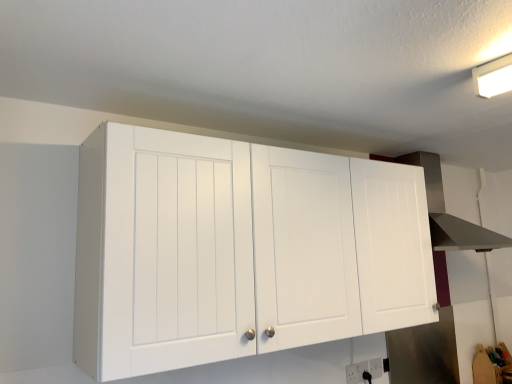
Question: In terms of width, does white plastic electric outlet at lower center, which appears as the 2th electric outlet when viewed from the front, look wider or thinner when compared to stainless steel vent at upper right?

Choices:
 (A) wide
 (B) thin

Answer: (B)

Question: Is white plastic electric outlet at lower center, placed as the first electric outlet when sorted from back to front, bigger or smaller than stainless steel vent at upper right?

Choices:
 (A) small
 (B) big

Answer: (A)

Question: Which is nearer to the white plastic electric outlet at lower center, the first electric outlet viewed from the front?

Choices:
 (A) stainless steel vent at upper right
 (B) white plastic electric outlet at lower center, placed as the first electric outlet when sorted from back to front
 (C) white matte cabinet at upper center

Answer: (B)

Question: Estimate the real-world distances between objects in this image. Which object is farther from the white matte cabinet at upper center?

Choices:
 (A) stainless steel vent at upper right
 (B) white plastic electric outlet at lower center, positioned as the 2th electric outlet in right-to-left order
 (C) white plastic electric outlet at lower center, arranged as the first electric outlet when viewed from the right

Answer: (A)